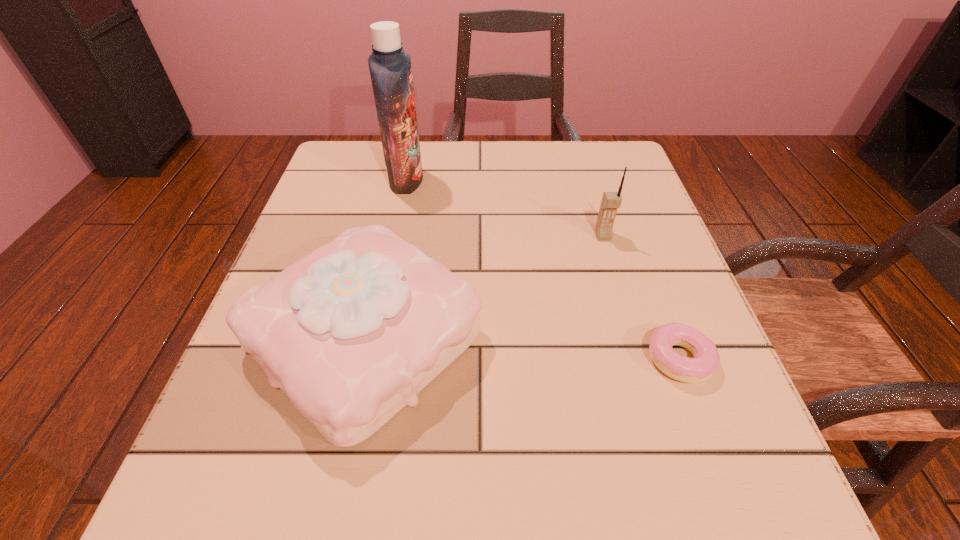
This screenshot has height=540, width=960. In order to click on free point between the shortest object and the shampoo in this screenshot , I will do `click(542, 269)`.

Locate which object is the third closest to the cake. Please provide its 2D coordinates. Your answer should be formatted as a tuple, i.e. [(x, y)], where the tuple contains the x and y coordinates of a point satisfying the conditions above.

[(706, 360)]

The image size is (960, 540). Find the location of `object that can be found as the closest to the second shortest object`. object that can be found as the closest to the second shortest object is located at coordinates (390, 69).

Image resolution: width=960 pixels, height=540 pixels. Identify the location of vacant space that satisfies the following two spatial constraints: 1. on the front of the third shortest object, where the keypad is located; 2. on the left side of the doughnut. (639, 359).

Image resolution: width=960 pixels, height=540 pixels. In order to click on free region that satisfies the following two spatial constraints: 1. on the front side of the cake; 2. on the left side of the shortest object in this screenshot , I will do `click(360, 359)`.

Locate an element on the screen. blank area in the image that satisfies the following two spatial constraints: 1. on the front label of the farthest object; 2. on the right side of the doughnut is located at coordinates (370, 359).

This screenshot has height=540, width=960. In order to click on free space in the image that satisfies the following two spatial constraints: 1. on the front of the second tallest object, where the keypad is located; 2. on the left side of the doughnut in this screenshot , I will do `click(639, 359)`.

Locate an element on the screen. free space that satisfies the following two spatial constraints: 1. on the front label of the shortest object; 2. on the right side of the tallest object is located at coordinates tap(370, 359).

I want to click on blank area in the image that satisfies the following two spatial constraints: 1. on the front label of the farthest object; 2. on the front side of the third tallest object, so click(373, 338).